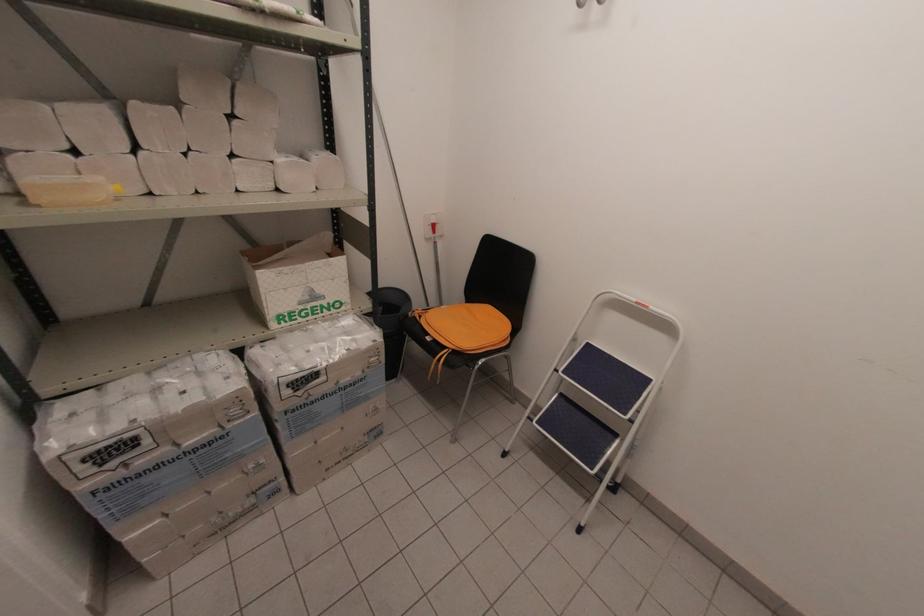
Find where to hang the metal wall hook. Please return your answer as a coordinate pair (x, y).

(588, 2)